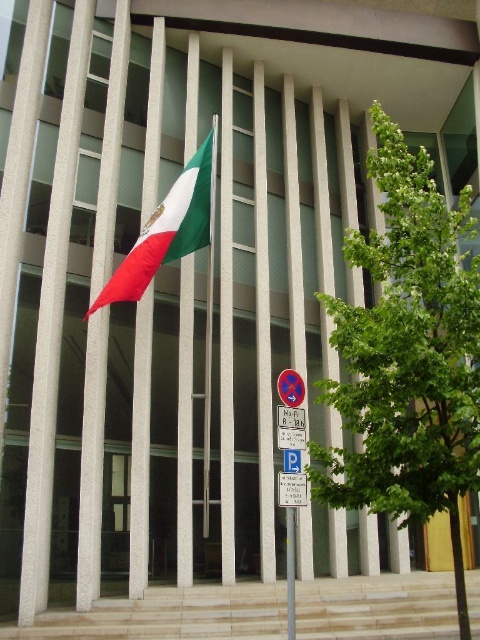
You are standing in front of the building and want to locate two points marked on the facade. The first point is at coordinates point (403,236) and the second is at point (207,284). Which point is closer to you?

Point (403,236) is closer to the viewer than point (207,284).